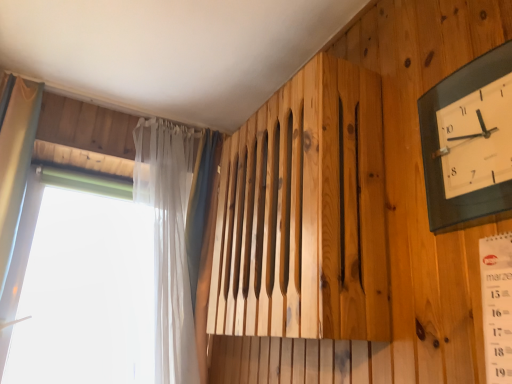
Question: Does transparent plastic window at left appear on the right side of translucent fabric curtain at left?

Choices:
 (A) no
 (B) yes

Answer: (B)

Question: From a real-world perspective, is transparent plastic window at left on top of translucent fabric curtain at left?

Choices:
 (A) no
 (B) yes

Answer: (A)

Question: From a real-world perspective, is transparent plastic window at left below translucent fabric curtain at left?

Choices:
 (A) yes
 (B) no

Answer: (A)

Question: From the image's perspective, is transparent plastic window at left under translucent fabric curtain at left?

Choices:
 (A) yes
 (B) no

Answer: (A)

Question: Could translucent fabric curtain at left be considered to be inside transparent plastic window at left?

Choices:
 (A) yes
 (B) no

Answer: (B)

Question: Can you confirm if transparent plastic window at left is wider than translucent fabric curtain at left?

Choices:
 (A) no
 (B) yes

Answer: (A)

Question: Considering the relative positions of black glass wall clock at upper right and transparent plastic window at left in the image provided, is black glass wall clock at upper right to the right of transparent plastic window at left from the viewer's perspective?

Choices:
 (A) no
 (B) yes

Answer: (B)

Question: Is black glass wall clock at upper right touching transparent plastic window at left?

Choices:
 (A) no
 (B) yes

Answer: (A)

Question: Can you confirm if black glass wall clock at upper right is smaller than transparent plastic window at left?

Choices:
 (A) yes
 (B) no

Answer: (A)

Question: From a real-world perspective, is black glass wall clock at upper right positioned over transparent plastic window at left based on gravity?

Choices:
 (A) no
 (B) yes

Answer: (B)

Question: Could you tell me if black glass wall clock at upper right is facing transparent plastic window at left?

Choices:
 (A) no
 (B) yes

Answer: (A)

Question: From a real-world perspective, is black glass wall clock at upper right physically below transparent plastic window at left?

Choices:
 (A) yes
 (B) no

Answer: (B)

Question: Can you confirm if translucent fabric curtain at left is bigger than transparent plastic window at left?

Choices:
 (A) yes
 (B) no

Answer: (B)